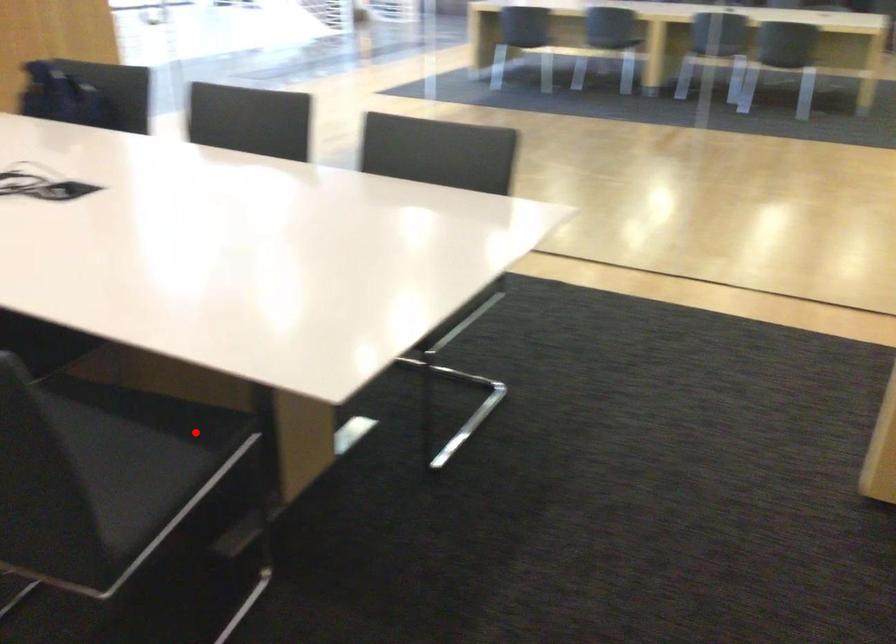
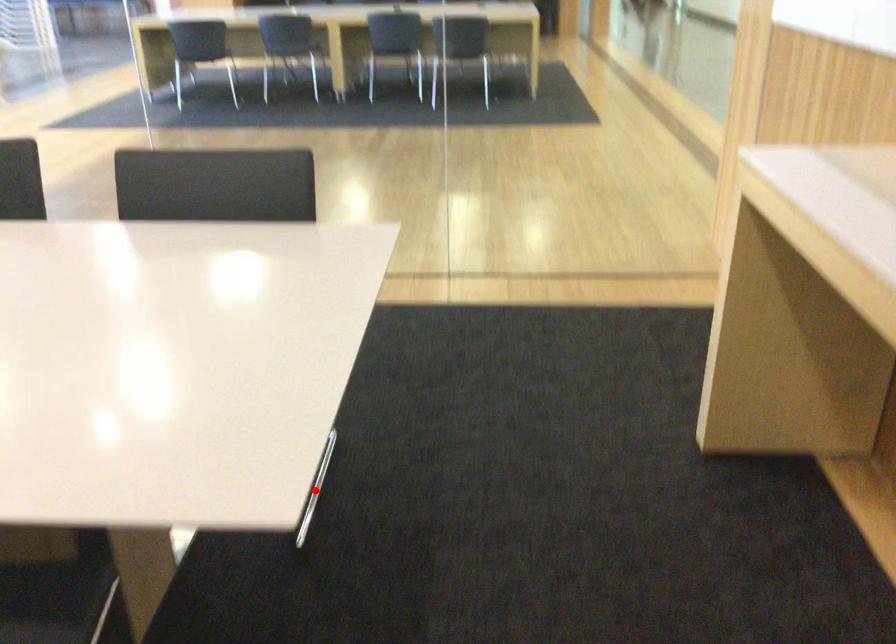
Consider the image. I am providing you with two images of the same scene from different viewpoints. A red point is marked on the first image and another point is marked on the second image. Is the marked point in image1 the same physical position as the marked point in image2?

No